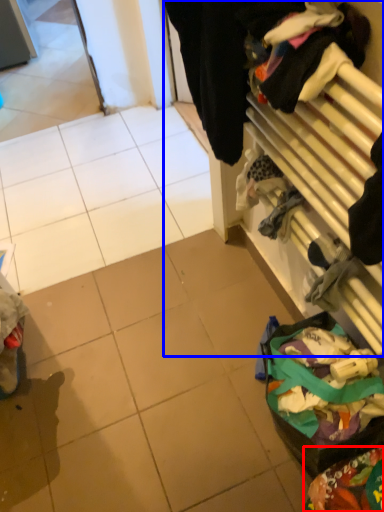
Question: Which point is closer to the camera, waste (highlighted by a red box) or closet (highlighted by a blue box)?

Choices:
 (A) waste
 (B) closet

Answer: (B)